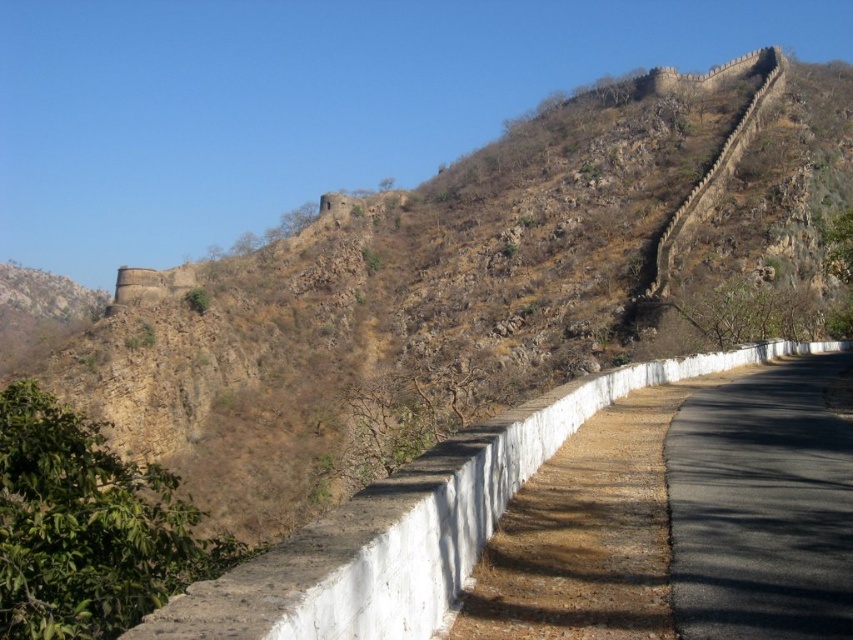
Question: Which point is closer to the camera?

Choices:
 (A) 318,520
 (B) 746,481

Answer: (A)

Question: Is white stone wall at center to the right of black asphalt road at center from the viewer's perspective?

Choices:
 (A) no
 (B) yes

Answer: (B)

Question: Is white stone wall at center positioned at the back of black asphalt road at center?

Choices:
 (A) no
 (B) yes

Answer: (A)

Question: Which point appears closest to the camera in this image?

Choices:
 (A) 734,428
 (B) 343,531

Answer: (B)

Question: Does white stone wall at center appear over black asphalt road at center?

Choices:
 (A) no
 (B) yes

Answer: (B)